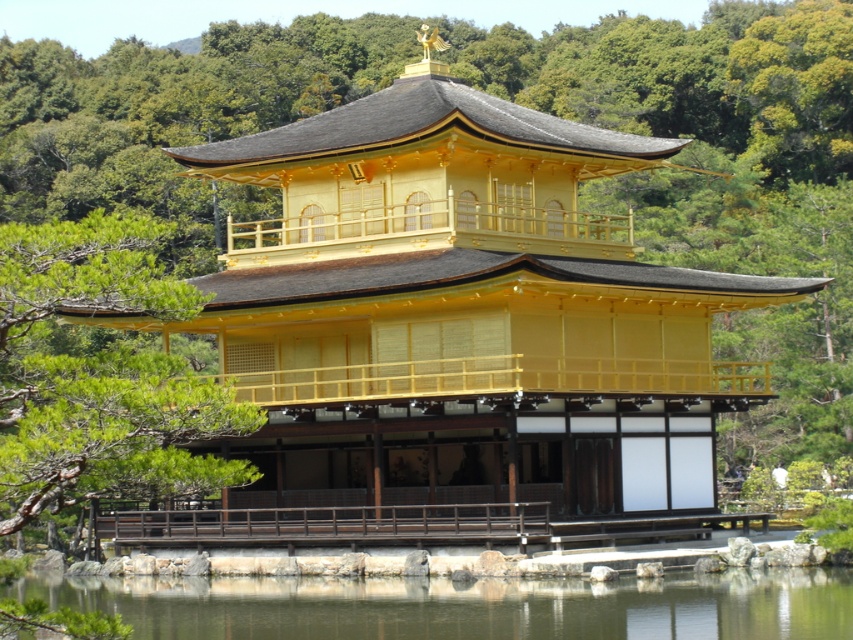
You are standing at the point marked by the coordinates point (x=100, y=376) in the image of Kinkakuji. What is the nearest object to you?

The point (x=100, y=376) marks green leafy tree at center, so the nearest object to you is the green leafy tree at center.

You are visiting the Golden Pavilion and want to take a photo of the pavilion with both the green leafy tree at center and the transparent water at lower center in the frame. Which object should you position closer to the camera to ensure both are visible?

You should position the transparent water at lower center closer to the camera because the green leafy tree at center is much taller, so placing the shorter transparent water at lower center nearer will help balance the composition and ensure both are visible in the photo.

You are standing in front of the Golden Pavilion and want to take a photo. You notice two points marked in the scene. Which point, point [144,380] or point [498,632], is closer to your camera lens?

Point [144,380] is closer to the camera than point [498,632].